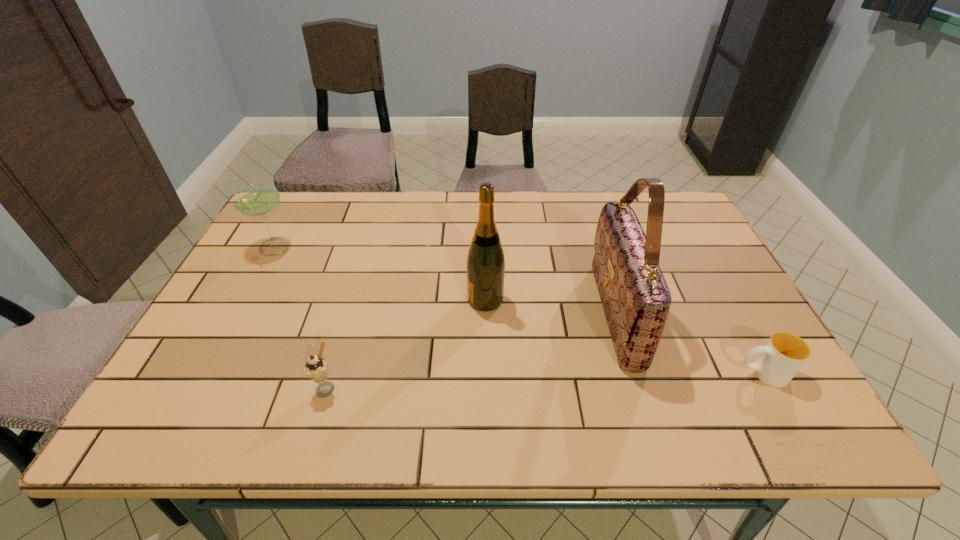
Where is `blank area at the far right corner`? This screenshot has height=540, width=960. blank area at the far right corner is located at coordinates pyautogui.click(x=686, y=228).

Find the location of `free spot between the icecream and the third object from right to left`. free spot between the icecream and the third object from right to left is located at coordinates (406, 343).

Find the location of a particular element. Image resolution: width=960 pixels, height=540 pixels. empty location between the second object from left to right and the wine bottle is located at coordinates [406, 343].

The height and width of the screenshot is (540, 960). I want to click on free point between the cup and the farthest object, so click(x=516, y=310).

Locate an element on the screen. vacant space that is in between the icecream and the third shortest object is located at coordinates (300, 317).

Find the location of `unoccupied position between the cup and the second object from right to left`. unoccupied position between the cup and the second object from right to left is located at coordinates (688, 343).

In order to click on vacant space in between the rightmost object and the handbag in this screenshot , I will do `click(688, 343)`.

Image resolution: width=960 pixels, height=540 pixels. Find the location of `vacant region between the icecream and the third object from right to left`. vacant region between the icecream and the third object from right to left is located at coordinates (406, 343).

Image resolution: width=960 pixels, height=540 pixels. I want to click on free space between the handbag and the farthest object, so click(x=444, y=280).

The image size is (960, 540). I want to click on empty space between the fourth object from left to right and the wine bottle, so click(550, 306).